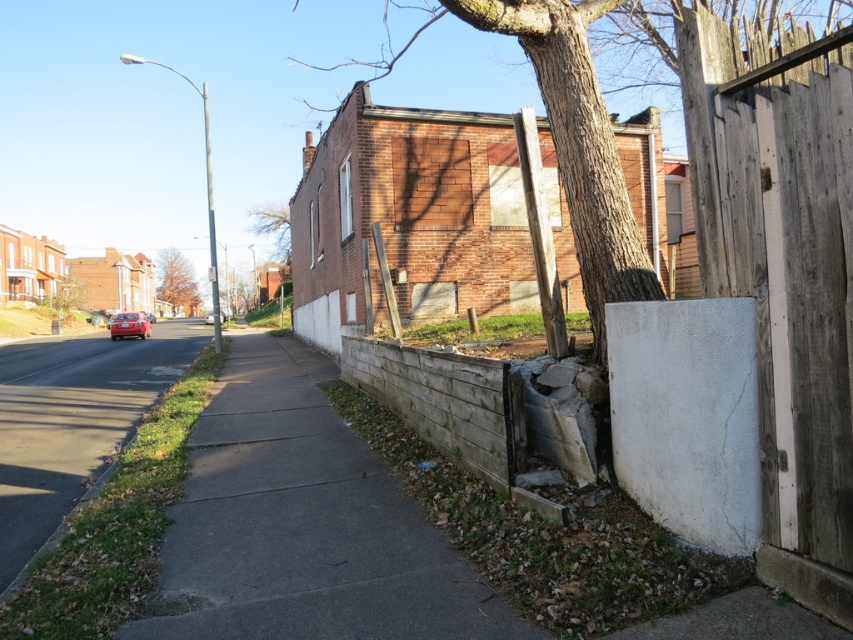
Which is behind, point (746, 0) or point (222, 321)?

The point (222, 321) is behind.

Is brown rough bark tree at center smaller than shiny red sedan at center?

No.

Locate an element on the screen. The width and height of the screenshot is (853, 640). brown rough bark tree at center is located at coordinates (618, 88).

At what (x,y) coordinates should I click in order to perform the action: click on brown rough bark tree at center. Please return your answer as a coordinate pair (x, y). Looking at the image, I should click on (618, 88).

Measure the distance between weathered wood gate at right and shiny red sedan at center.

weathered wood gate at right and shiny red sedan at center are 22.37 meters apart.

Is weathered wood gate at right shorter than shiny red sedan at center?

No, weathered wood gate at right is not shorter than shiny red sedan at center.

Who is more forward, [817,332] or [209,316]?

Point [817,332] is in front.

This screenshot has height=640, width=853. Identify the location of weathered wood gate at right. point(782,275).

How distant is weathered wood gate at right from shiny red car at left?

weathered wood gate at right and shiny red car at left are 119.39 feet apart from each other.

Does weathered wood gate at right have a greater width compared to shiny red car at left?

Incorrect, weathered wood gate at right's width does not surpass shiny red car at left's.

Where is `weathered wood gate at right`? The width and height of the screenshot is (853, 640). weathered wood gate at right is located at coordinates (782, 275).